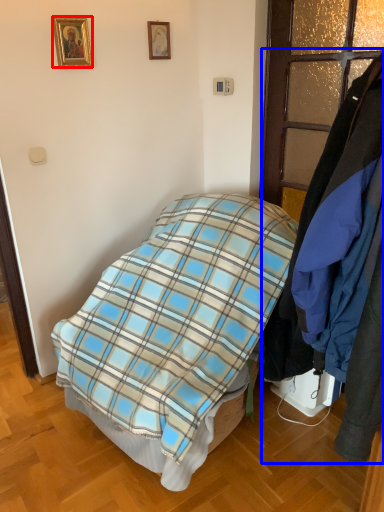
Question: Which object appears closest to the camera in this image, picture frame (highlighted by a red box) or closet (highlighted by a blue box)?

Choices:
 (A) picture frame
 (B) closet

Answer: (B)